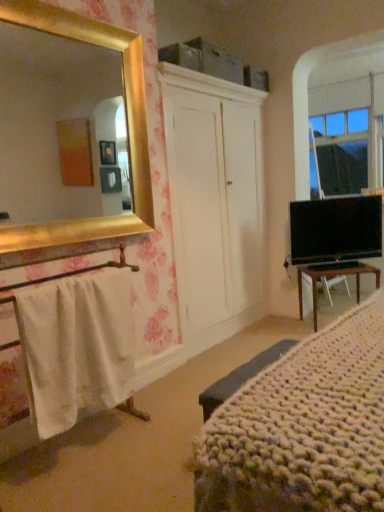
Question: Is white cotton towel at left in contact with knitted fabric bed at lower right?

Choices:
 (A) yes
 (B) no

Answer: (B)

Question: Is the depth of white cotton towel at left less than that of knitted fabric bed at lower right?

Choices:
 (A) yes
 (B) no

Answer: (B)

Question: From the image's perspective, is white cotton towel at left under knitted fabric bed at lower right?

Choices:
 (A) no
 (B) yes

Answer: (B)

Question: Is white cotton towel at left facing towards knitted fabric bed at lower right?

Choices:
 (A) no
 (B) yes

Answer: (B)

Question: From a real-world perspective, does white cotton towel at left sit lower than knitted fabric bed at lower right?

Choices:
 (A) yes
 (B) no

Answer: (A)

Question: Considering the positions of black glossy tv at right and brown wooden desk at lower right in the image, is black glossy tv at right taller or shorter than brown wooden desk at lower right?

Choices:
 (A) short
 (B) tall

Answer: (B)

Question: Looking at their shapes, would you say black glossy tv at right is wider or thinner than brown wooden desk at lower right?

Choices:
 (A) wide
 (B) thin

Answer: (B)

Question: Would you say black glossy tv at right is inside or outside brown wooden desk at lower right?

Choices:
 (A) outside
 (B) inside

Answer: (A)

Question: Is black glossy tv at right bigger or smaller than brown wooden desk at lower right?

Choices:
 (A) big
 (B) small

Answer: (B)

Question: Do you think brown wooden desk at lower right is within knitted fabric bed at lower right, or outside of it?

Choices:
 (A) inside
 (B) outside

Answer: (B)

Question: Considering the positions of brown wooden desk at lower right and knitted fabric bed at lower right in the image, is brown wooden desk at lower right taller or shorter than knitted fabric bed at lower right?

Choices:
 (A) tall
 (B) short

Answer: (A)

Question: From a real-world perspective, is brown wooden desk at lower right physically located above or below knitted fabric bed at lower right?

Choices:
 (A) below
 (B) above

Answer: (A)

Question: In terms of size, does brown wooden desk at lower right appear bigger or smaller than knitted fabric bed at lower right?

Choices:
 (A) small
 (B) big

Answer: (A)

Question: From their relative heights in the image, would you say knitted fabric bed at lower right is taller or shorter than white cotton towel at left?

Choices:
 (A) short
 (B) tall

Answer: (A)

Question: Considering the relative positions of knitted fabric bed at lower right and white cotton towel at left in the image provided, is knitted fabric bed at lower right to the left or to the right of white cotton towel at left?

Choices:
 (A) right
 (B) left

Answer: (A)